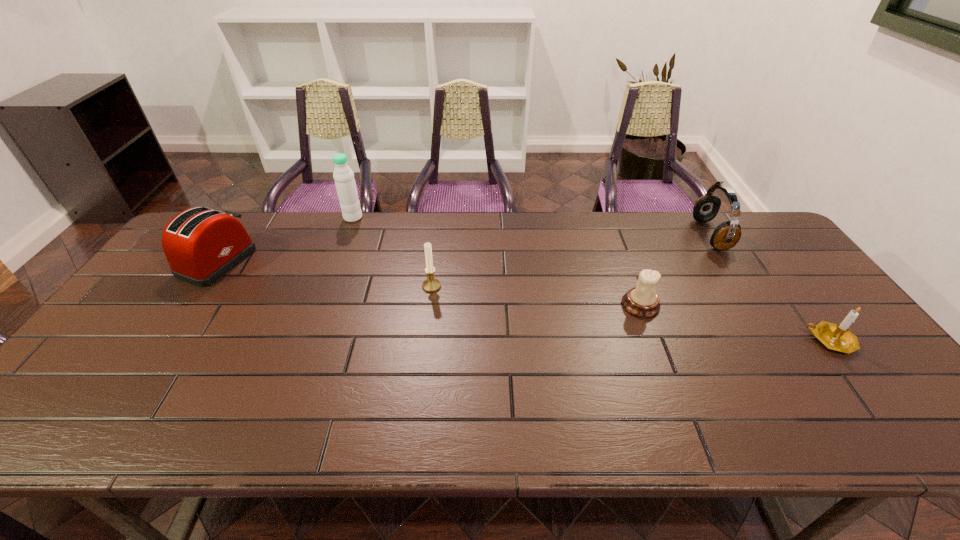
Locate an element on the screen. The height and width of the screenshot is (540, 960). vacant space located on the ear cups of the headset is located at coordinates (683, 234).

At what (x,y) coordinates should I click in order to perform the action: click on vacant position located 0.220m on the ear cups of the headset. Please return your answer as a coordinate pair (x, y). This screenshot has width=960, height=540. Looking at the image, I should click on (631, 234).

In order to click on vacant point located 0.320m on the ear cups of the headset in this screenshot , I will do `click(601, 234)`.

Where is `free region located 0.340m on the front of the leftmost object`? This screenshot has height=540, width=960. free region located 0.340m on the front of the leftmost object is located at coordinates (129, 389).

Locate an element on the screen. The height and width of the screenshot is (540, 960). free space located 0.230m on the right of the tallest candle holder is located at coordinates (521, 286).

Locate an element on the screen. free space located on the back of the third object from right to left is located at coordinates (612, 232).

Locate an element on the screen. The height and width of the screenshot is (540, 960). free space located 0.050m on the left of the nearest object is located at coordinates (787, 341).

Locate an element on the screen. The image size is (960, 540). water bottle located in the far edge section of the desktop is located at coordinates (345, 183).

The height and width of the screenshot is (540, 960). Find the location of `headset at the far edge`. headset at the far edge is located at coordinates pyautogui.click(x=726, y=235).

This screenshot has width=960, height=540. In order to click on toaster that is positioned at the far edge in this screenshot , I will do `click(201, 245)`.